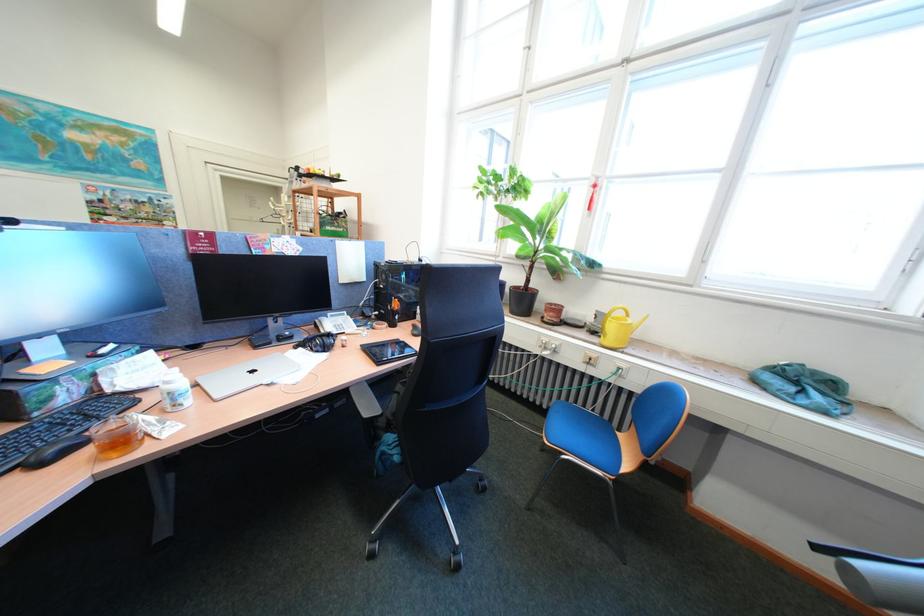
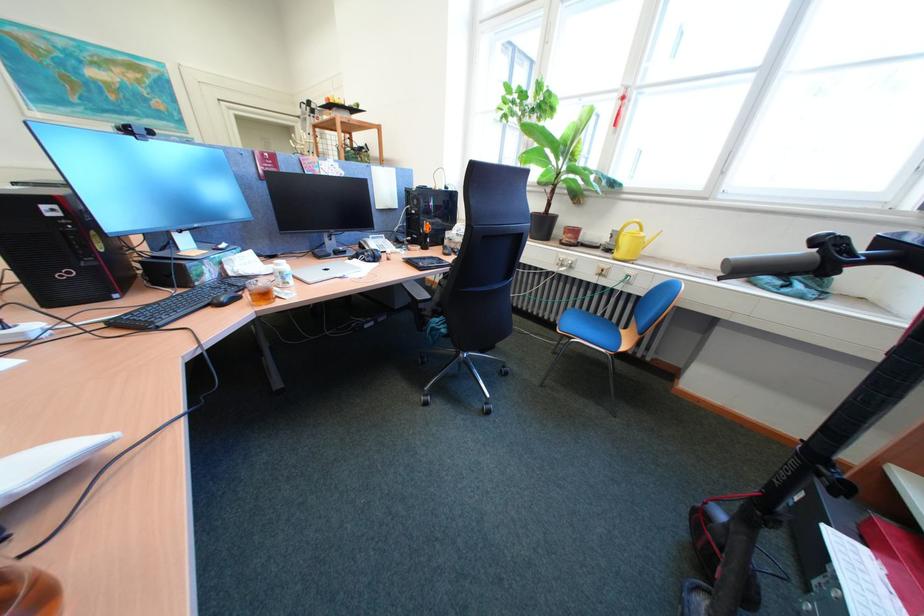
Which direction would the cameraman need to move to produce the second image?

The cameraman moved toward left, backward.